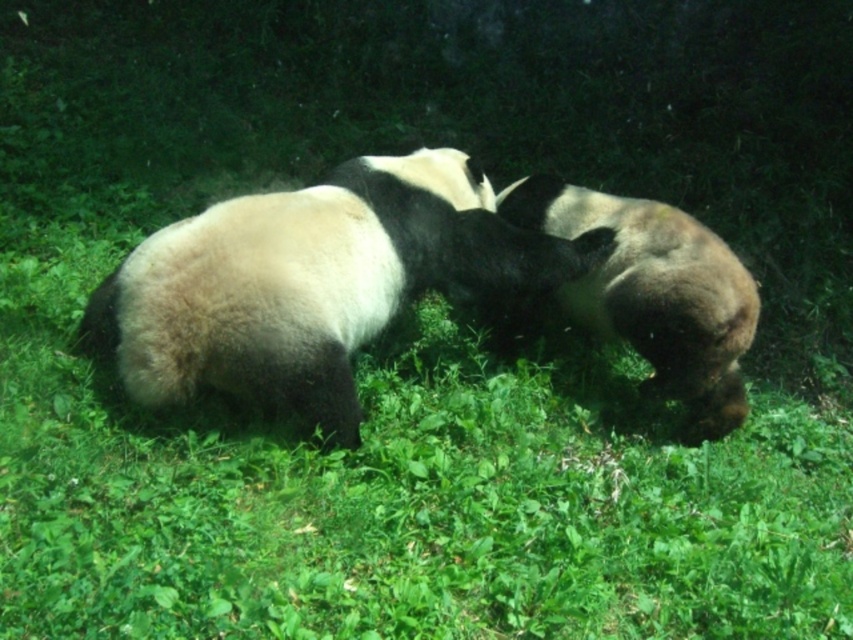
Who is shorter, black and white fur panda at center or black fuzzy panda at right?

Standing shorter between the two is black and white fur panda at center.

Is point (312, 269) positioned behind point (538, 179)?

No.

Image resolution: width=853 pixels, height=640 pixels. In order to click on black and white fur panda at center in this screenshot , I will do `click(312, 282)`.